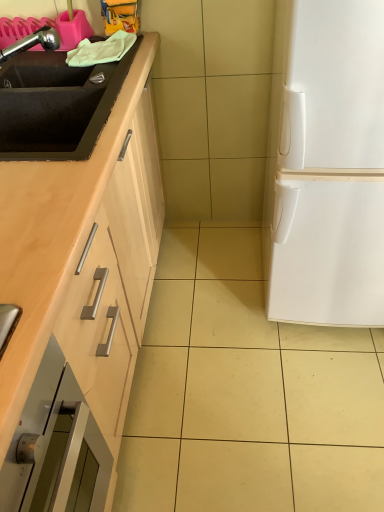
Question: Is white matte refrigerator at right aimed at black matte sink at left, the 1th sink when ordered from bottom to top?

Choices:
 (A) yes
 (B) no

Answer: (B)

Question: Is white matte refrigerator at right turned away from black matte sink at left, which appears as the second sink when viewed from the top?

Choices:
 (A) yes
 (B) no

Answer: (B)

Question: From a real-world perspective, is white matte refrigerator at right positioned over black matte sink at left, which appears as the second sink when viewed from the top, based on gravity?

Choices:
 (A) yes
 (B) no

Answer: (B)

Question: Is white matte refrigerator at right at the left side of black matte sink at left, the 1th sink when ordered from bottom to top?

Choices:
 (A) no
 (B) yes

Answer: (A)

Question: Does white matte refrigerator at right lie in front of black matte sink at left, the 1th sink when ordered from bottom to top?

Choices:
 (A) no
 (B) yes

Answer: (B)

Question: In terms of size, does white matte refrigerator at right appear bigger or smaller than black matte sink at left, which appears as the second sink when viewed from the top?

Choices:
 (A) small
 (B) big

Answer: (B)

Question: From a real-world perspective, is white matte refrigerator at right above or below black matte sink at left, the 1th sink when ordered from bottom to top?

Choices:
 (A) above
 (B) below

Answer: (B)

Question: From the image's perspective, relative to black matte sink at left, the 1th sink when ordered from bottom to top, is white matte refrigerator at right above or below?

Choices:
 (A) above
 (B) below

Answer: (B)

Question: Would you say white matte refrigerator at right is inside or outside black matte sink at left, the 1th sink when ordered from bottom to top?

Choices:
 (A) inside
 (B) outside

Answer: (B)

Question: Is point (16, 75) closer or farther from the camera than point (279, 101)?

Choices:
 (A) closer
 (B) farther

Answer: (A)

Question: Looking at the image, does chrome metallic faucet at upper left, the second sink from the bottom, seem bigger or smaller compared to white matte refrigerator at right?

Choices:
 (A) big
 (B) small

Answer: (B)

Question: From the image's perspective, is chrome metallic faucet at upper left, the second sink from the bottom, located above or below white matte refrigerator at right?

Choices:
 (A) below
 (B) above

Answer: (B)

Question: Which is correct: chrome metallic faucet at upper left, placed as the 1th sink when sorted from top to bottom, is inside white matte refrigerator at right, or outside of it?

Choices:
 (A) inside
 (B) outside

Answer: (B)

Question: Is black matte sink at left, which appears as the second sink when viewed from the top, to the left or to the right of white matte refrigerator at right in the image?

Choices:
 (A) right
 (B) left

Answer: (B)

Question: From their relative heights in the image, would you say black matte sink at left, which appears as the second sink when viewed from the top, is taller or shorter than white matte refrigerator at right?

Choices:
 (A) short
 (B) tall

Answer: (A)